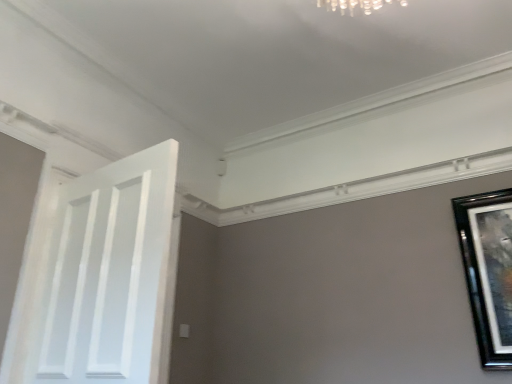
Find the location of a particular element. The height and width of the screenshot is (384, 512). black glossy picture frame at right is located at coordinates (488, 271).

Image resolution: width=512 pixels, height=384 pixels. What do you see at coordinates (488, 271) in the screenshot? I see `black glossy picture frame at right` at bounding box center [488, 271].

Locate an element on the screen. The image size is (512, 384). white painted wood door at left is located at coordinates (110, 272).

The height and width of the screenshot is (384, 512). What do you see at coordinates (110, 272) in the screenshot?
I see `white painted wood door at left` at bounding box center [110, 272].

Image resolution: width=512 pixels, height=384 pixels. Identify the location of black glossy picture frame at right. (488, 271).

Is white painted wood door at left to the left of black glossy picture frame at right from the viewer's perspective?

Indeed, white painted wood door at left is positioned on the left side of black glossy picture frame at right.

Is white painted wood door at left in front of or behind black glossy picture frame at right in the image?

white painted wood door at left is positioned closer to the viewer than black glossy picture frame at right.

Which is in front, point (91, 364) or point (510, 204)?

The point (91, 364) is in front.

From the image's perspective, is white painted wood door at left above or below black glossy picture frame at right?

white painted wood door at left is situated higher than black glossy picture frame at right in the image.

From a real-world perspective, is white painted wood door at left above or below black glossy picture frame at right?

Clearly, from a real-world perspective, white painted wood door at left is below black glossy picture frame at right.

Does white painted wood door at left have a lesser width compared to black glossy picture frame at right?

In fact, white painted wood door at left might be wider than black glossy picture frame at right.

Who is taller, white painted wood door at left or black glossy picture frame at right?

white painted wood door at left is taller.

Which of these two, white painted wood door at left or black glossy picture frame at right, is smaller?

Smaller between the two is black glossy picture frame at right.

Is white painted wood door at left not inside black glossy picture frame at right?

Yes, white painted wood door at left is not within black glossy picture frame at right.

Is white painted wood door at left in contact with black glossy picture frame at right?

No, white painted wood door at left is not beside black glossy picture frame at right.

Is white painted wood door at left oriented away from black glossy picture frame at right?

No, black glossy picture frame at right is not at the back of white painted wood door at left.

This screenshot has width=512, height=384. I want to click on door in front of the black glossy picture frame at right, so click(110, 272).

Which is more to the left, black glossy picture frame at right or white painted wood door at left?

white painted wood door at left.

Looking at this image, which object is further away from the camera taking this photo, black glossy picture frame at right or white painted wood door at left?

black glossy picture frame at right is further away from the camera.

Considering the positions of points (509, 332) and (126, 298), is point (509, 332) closer to camera compared to point (126, 298)?

No, it is behind (126, 298).

From the image's perspective, is black glossy picture frame at right located above or below white painted wood door at left?

Clearly, from the image's perspective, black glossy picture frame at right is below white painted wood door at left.

From a real-world perspective, which object stands above the other?

black glossy picture frame at right is physically above.

From the picture: Considering the sizes of black glossy picture frame at right and white painted wood door at left in the image, is black glossy picture frame at right wider or thinner than white painted wood door at left?

Clearly, black glossy picture frame at right has less width compared to white painted wood door at left.

Which of these two, black glossy picture frame at right or white painted wood door at left, stands taller?

With more height is white painted wood door at left.

Is black glossy picture frame at right bigger than white painted wood door at left?

No, black glossy picture frame at right is not bigger than white painted wood door at left.

Can white painted wood door at left be found inside black glossy picture frame at right?

No, black glossy picture frame at right does not contain white painted wood door at left.

Would you consider black glossy picture frame at right to be distant from white painted wood door at left?

Yes, black glossy picture frame at right is far from white painted wood door at left.

Is black glossy picture frame at right positioned with its back to white painted wood door at left?

No, black glossy picture frame at right is not facing away from white painted wood door at left.

Can you tell me how much black glossy picture frame at right and white painted wood door at left differ in facing direction?

black glossy picture frame at right and white painted wood door at left are facing 174 degrees away from each other.

Where is `picture frame above the white painted wood door at left (from a real-world perspective)`? This screenshot has height=384, width=512. picture frame above the white painted wood door at left (from a real-world perspective) is located at coordinates (488, 271).

Identify the location of picture frame lying below the white painted wood door at left (from the image's perspective). (488, 271).

Identify the location of picture frame behind the white painted wood door at left. (488, 271).